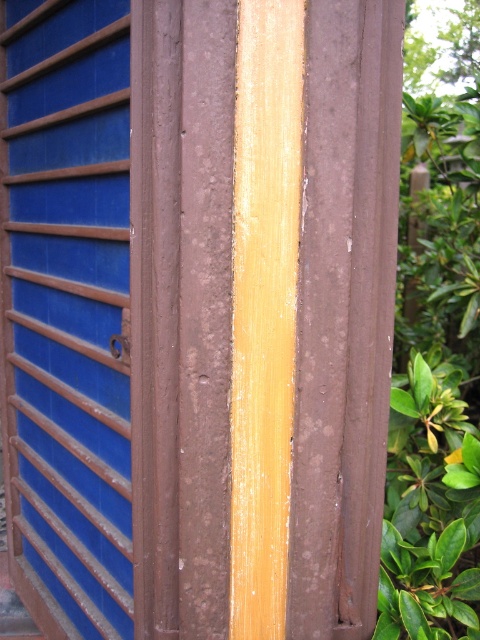
Question: Does blue painted wood door at left appear under yellow polished wood at center?

Choices:
 (A) yes
 (B) no

Answer: (A)

Question: Which object appears farthest from the camera in this image?

Choices:
 (A) blue painted wood door at left
 (B) brown matte wood at center
 (C) yellow polished wood at center

Answer: (A)

Question: Among these objects, which one is farthest from the camera?

Choices:
 (A) blue painted wood door at left
 (B) brown matte wood at center

Answer: (A)

Question: Among these objects, which one is nearest to the camera?

Choices:
 (A) yellow polished wood at center
 (B) blue painted wood door at left
 (C) brown matte wood at center

Answer: (A)

Question: Is blue painted wood door at left closer to the viewer compared to brown matte wood at center?

Choices:
 (A) yes
 (B) no

Answer: (B)

Question: Does brown matte wood at center have a larger size compared to yellow polished wood at center?

Choices:
 (A) no
 (B) yes

Answer: (B)